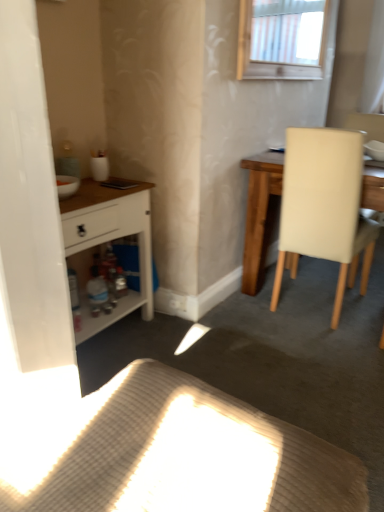
Question: Is transparent plastic screen door at left facing away from white matte cabinet at left?

Choices:
 (A) yes
 (B) no

Answer: (B)

Question: Can you confirm if transparent plastic screen door at left is positioned to the left of white matte cabinet at left?

Choices:
 (A) yes
 (B) no

Answer: (B)

Question: From the image's perspective, is transparent plastic screen door at left on top of white matte cabinet at left?

Choices:
 (A) no
 (B) yes

Answer: (B)

Question: From a real-world perspective, is transparent plastic screen door at left over white matte cabinet at left?

Choices:
 (A) no
 (B) yes

Answer: (B)

Question: Does transparent plastic screen door at left contain white matte cabinet at left?

Choices:
 (A) yes
 (B) no

Answer: (B)

Question: Is transparent plastic screen door at left next to white matte cabinet at left and touching it?

Choices:
 (A) yes
 (B) no

Answer: (B)

Question: Is beige leather chair at right inside woven fabric cushion at lower center?

Choices:
 (A) yes
 (B) no

Answer: (B)

Question: Does woven fabric cushion at lower center have a greater height compared to beige leather chair at right?

Choices:
 (A) no
 (B) yes

Answer: (A)

Question: Is woven fabric cushion at lower center positioned with its back to beige leather chair at right?

Choices:
 (A) yes
 (B) no

Answer: (B)

Question: Can you confirm if woven fabric cushion at lower center is positioned to the right of beige leather chair at right?

Choices:
 (A) yes
 (B) no

Answer: (B)

Question: Is woven fabric cushion at lower center aimed at beige leather chair at right?

Choices:
 (A) yes
 (B) no

Answer: (B)

Question: From a real-world perspective, is woven fabric cushion at lower center over beige leather chair at right?

Choices:
 (A) no
 (B) yes

Answer: (A)

Question: Is white glossy bowl at upper right bigger than white matte cabinet at left?

Choices:
 (A) no
 (B) yes

Answer: (A)